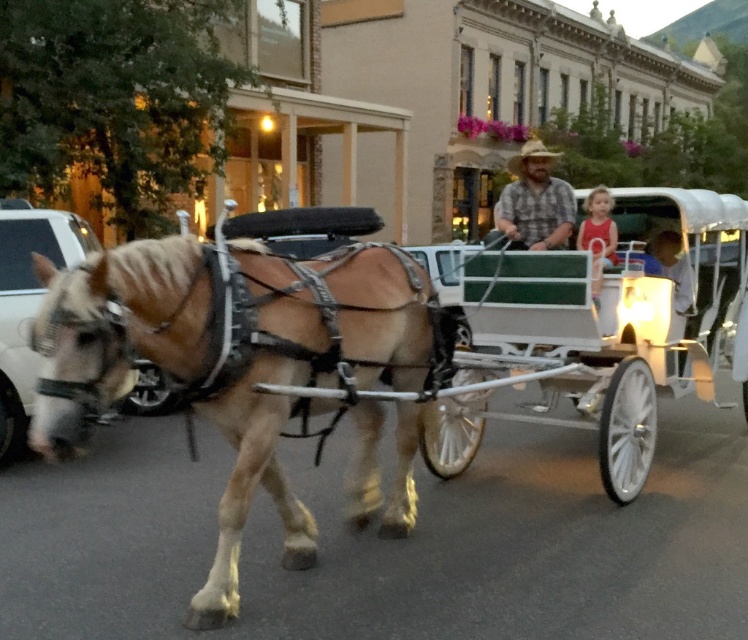
Between metallic silver car at left and matte red shirt at center, which one is positioned lower?

metallic silver car at left is below.

Can you confirm if metallic silver car at left is bigger than matte red shirt at center?

Yes, metallic silver car at left is bigger than matte red shirt at center.

Where is `metallic silver car at left`? This screenshot has width=748, height=640. metallic silver car at left is located at coordinates point(27,304).

The image size is (748, 640). Identify the location of metallic silver car at left. (27, 304).

Who is more distant from viewer, (61, 260) or (554, 212)?

The point (61, 260) is more distant.

The image size is (748, 640). Describe the element at coordinates (27, 304) in the screenshot. I see `metallic silver car at left` at that location.

Is point (96, 241) behind point (557, 241)?

That is True.

At what (x,y) coordinates should I click in order to perform the action: click on metallic silver car at left. Please return your answer as a coordinate pair (x, y). Looking at the image, I should click on (27, 304).

Does plaid shirt at center appear on the left side of light blue shirt at center?

No, plaid shirt at center is not to the left of light blue shirt at center.

Which of these two, plaid shirt at center or light blue shirt at center, stands shorter?

With less height is light blue shirt at center.

Image resolution: width=748 pixels, height=640 pixels. What are the coordinates of `plaid shirt at center` in the screenshot? It's located at (536, 202).